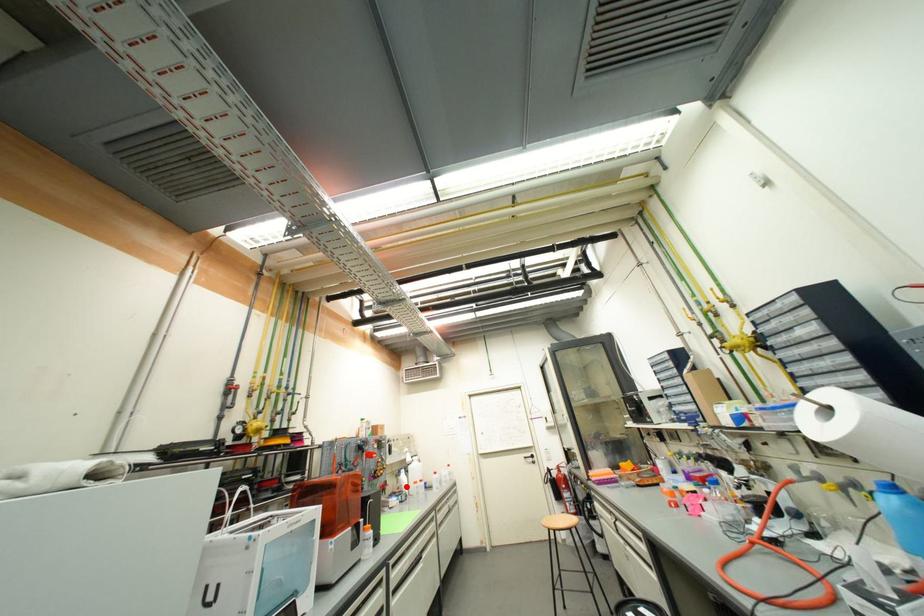
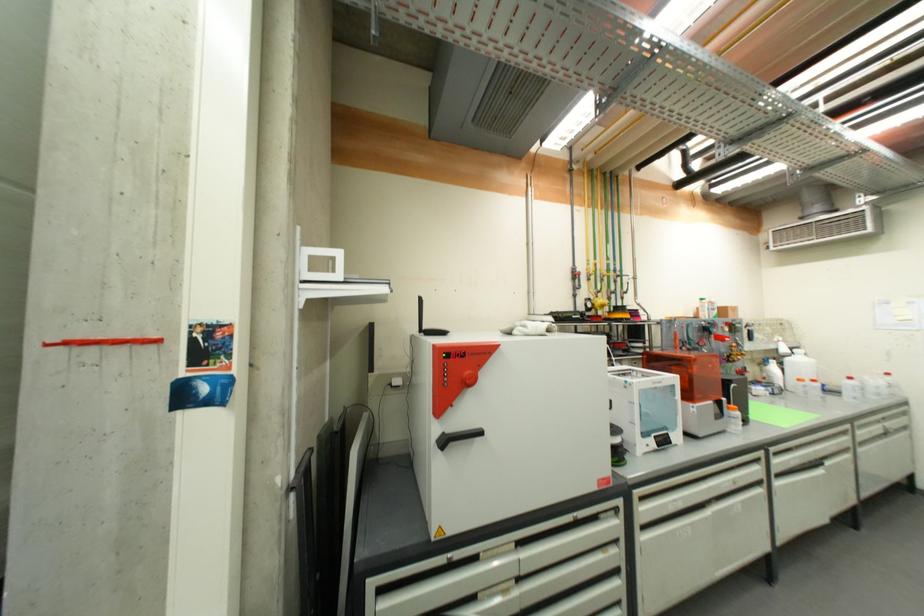
Question: A red point is marked in image1. In image2, is the corresponding 3D point closer to the camera or farther? Reply with the corresponding letter.

Choices:
 (A) The corresponding 3D point is closer.
 (B) The corresponding 3D point is farther.

Answer: (A)